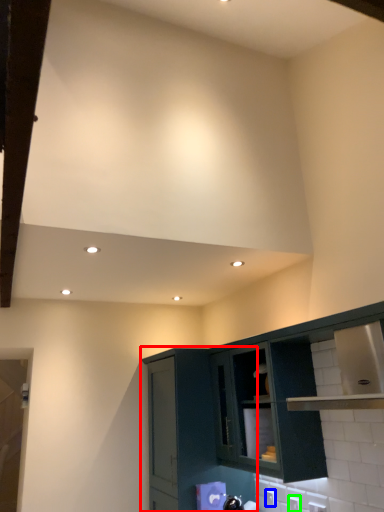
Question: Which object is the farthest from cabinetry (highlighted by a red box)? Choose among these: electric outlet (highlighted by a blue box) or electric outlet (highlighted by a green box).

Choices:
 (A) electric outlet
 (B) electric outlet

Answer: (B)